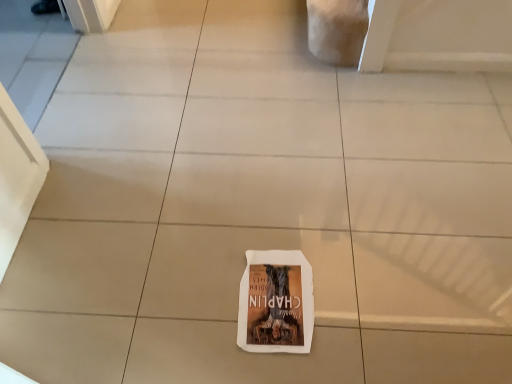
This screenshot has width=512, height=384. I want to click on vacant area situated below white paper flyer at center (from a real-world perspective), so click(x=275, y=296).